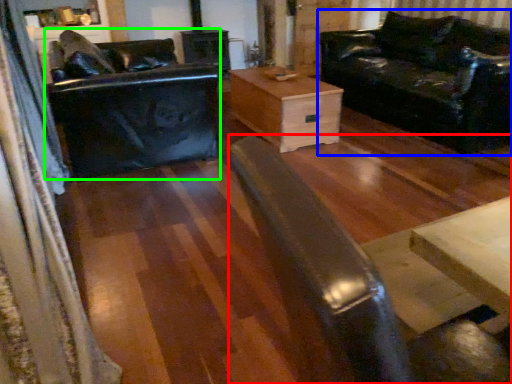
Question: Estimate the real-world distances between objects in this image. Which object is farther from wide (highlighted by a red box), studio couch (highlighted by a blue box) or swivel chair (highlighted by a green box)?

Choices:
 (A) studio couch
 (B) swivel chair

Answer: (A)